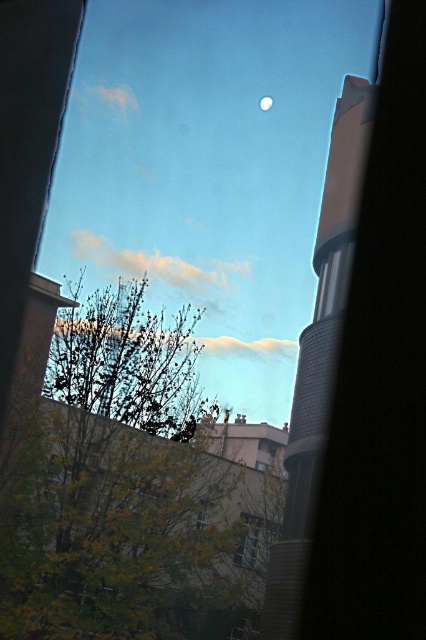
Question: Which object appears farthest from the camera in this image?

Choices:
 (A) transparent glass window at center
 (B) white glossy moon at upper center
 (C) green leafy tree at lower left
 (D) clear glass window at center

Answer: (B)

Question: Which of the following is the farthest from the observer?

Choices:
 (A) transparent glass window at center
 (B) white glossy moon at upper center

Answer: (B)

Question: Observing the image, what is the correct spatial positioning of transparent glass window at center in reference to clear glass window at center?

Choices:
 (A) above
 (B) below

Answer: (B)

Question: Among these points, which one is nearest to the camera?

Choices:
 (A) (249, 548)
 (B) (215, 628)

Answer: (B)

Question: Can you confirm if green leafy tree at lower left is bigger than white glossy moon at upper center?

Choices:
 (A) no
 (B) yes

Answer: (B)

Question: From the image, what is the correct spatial relationship of green leafy tree at lower left in relation to transparent glass window at center?

Choices:
 (A) right
 (B) left

Answer: (B)